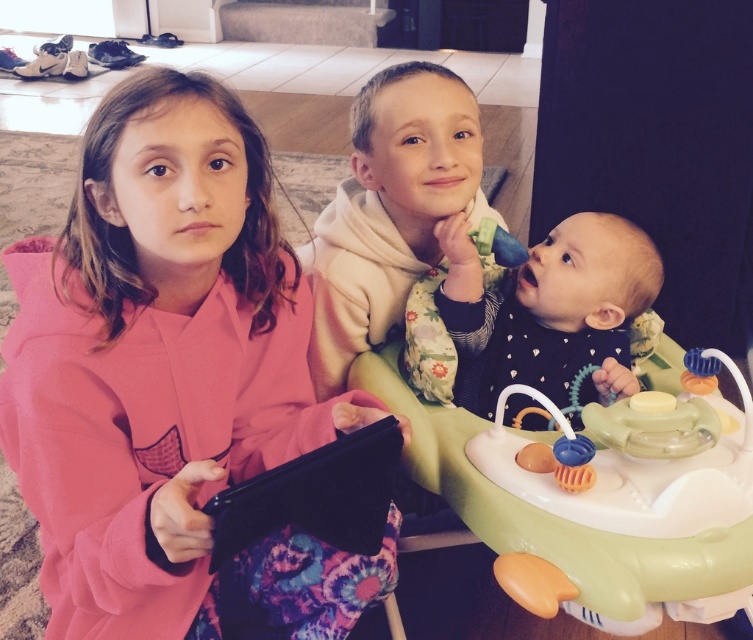
Can you confirm if white soft hoodie at center is positioned above soft green highchair at center?

Yes.

Based on the photo, who is more forward, (383,150) or (633,316)?

Point (383,150)

The height and width of the screenshot is (640, 753). Find the location of `white soft hoodie at center`. white soft hoodie at center is located at coordinates (389, 209).

Does pink matte hoodie at center have a greater width compared to white soft hoodie at center?

Indeed, pink matte hoodie at center has a greater width compared to white soft hoodie at center.

This screenshot has height=640, width=753. Describe the element at coordinates (171, 381) in the screenshot. I see `pink matte hoodie at center` at that location.

Which is in front, point (160, 492) or point (468, 102)?

Positioned in front is point (160, 492).

In order to click on pink matte hoodie at center in this screenshot , I will do `click(171, 381)`.

Does pink matte hoodie at center have a lesser width compared to soft green highchair at center?

No.

Which of these two, pink matte hoodie at center or soft green highchair at center, stands shorter?

soft green highchair at center is shorter.

Does point (154, 88) come closer to viewer compared to point (657, 256)?

Yes, point (154, 88) is closer to viewer.

Where is `pink matte hoodie at center`? pink matte hoodie at center is located at coordinates (171, 381).